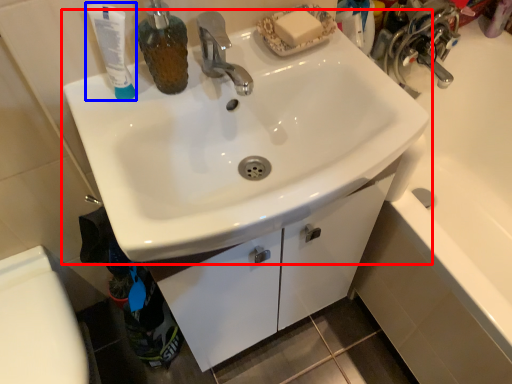
Question: Among these objects, which one is nearest to the camera, sink (highlighted by a red box) or toothpaste (highlighted by a blue box)?

Choices:
 (A) sink
 (B) toothpaste

Answer: (A)